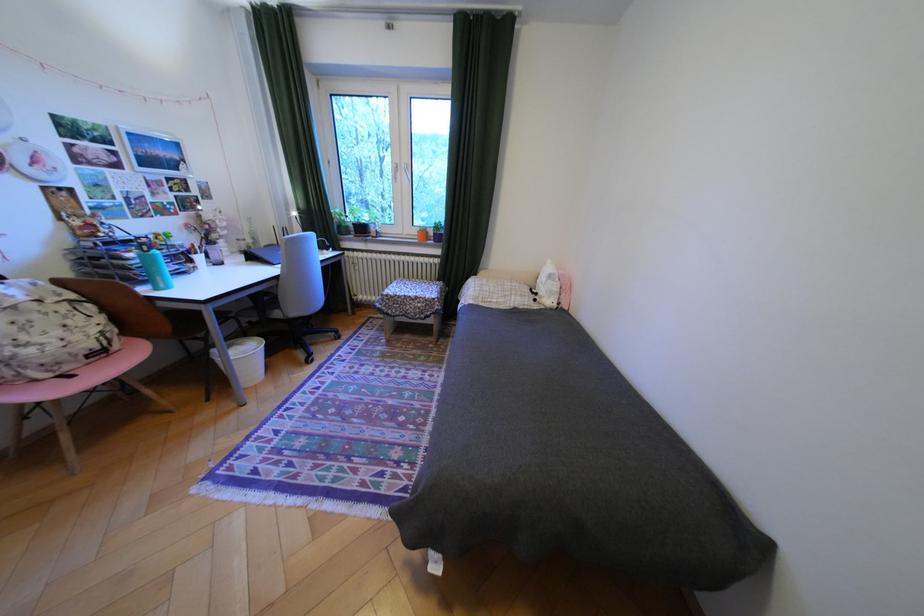
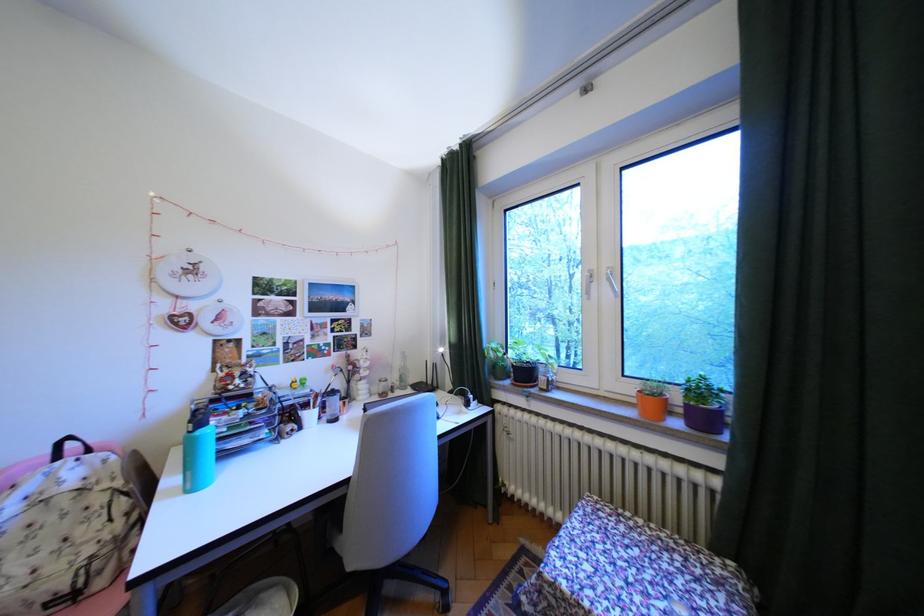
The point at (448, 227) is marked in the first image. Where is the corresponding point in the second image?

(710, 391)